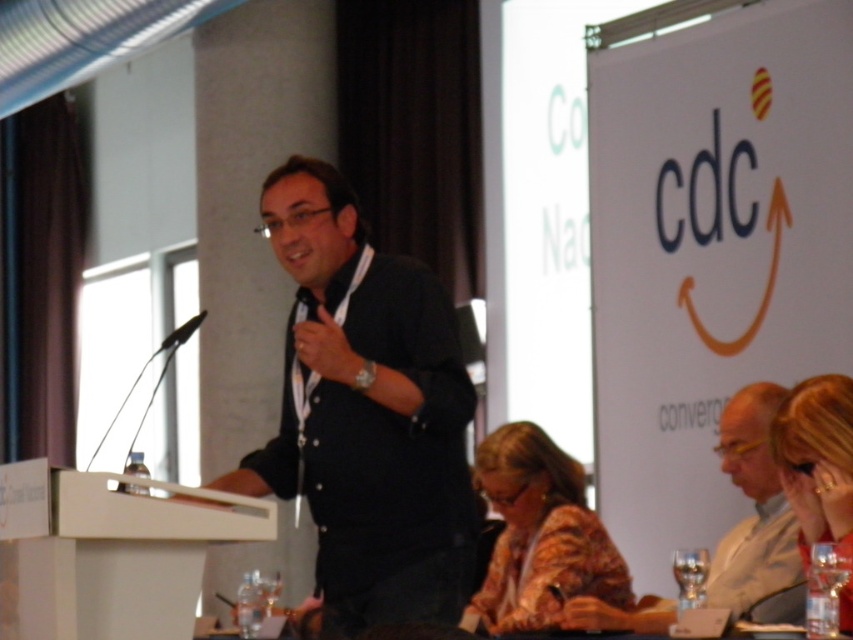
Question: Is light brown leather jacket at lower right further to camera compared to transparent glass at lower right?

Choices:
 (A) no
 (B) yes

Answer: (B)

Question: Is transparent glass at lower right wider than black matte microphone at left?

Choices:
 (A) no
 (B) yes

Answer: (A)

Question: Which of the following is the farthest from the observer?

Choices:
 (A) (830, 532)
 (B) (361, 536)
 (C) (15, 598)

Answer: (B)

Question: Does white matte podium at center have a larger size compared to light brown leather jacket at lower right?

Choices:
 (A) yes
 (B) no

Answer: (B)

Question: Which of the following is the farthest from the observer?

Choices:
 (A) (502, 580)
 (B) (415, 282)
 (C) (763, 403)
 (D) (676, 566)

Answer: (A)

Question: Which of the following is the closest to the observer?

Choices:
 (A) (204, 310)
 (B) (102, 614)

Answer: (B)